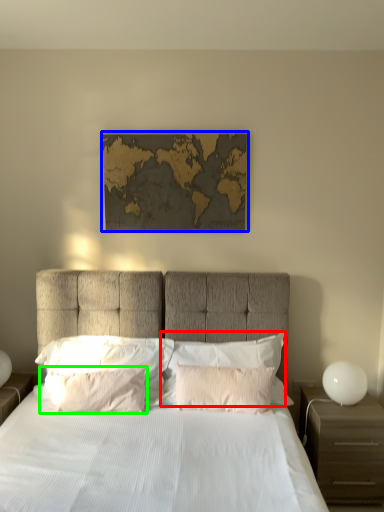
Question: Estimate the real-world distances between objects in this image. Which object is farther from pillow (highlighted by a red box), picture frame (highlighted by a blue box) or pillow (highlighted by a green box)?

Choices:
 (A) picture frame
 (B) pillow

Answer: (A)